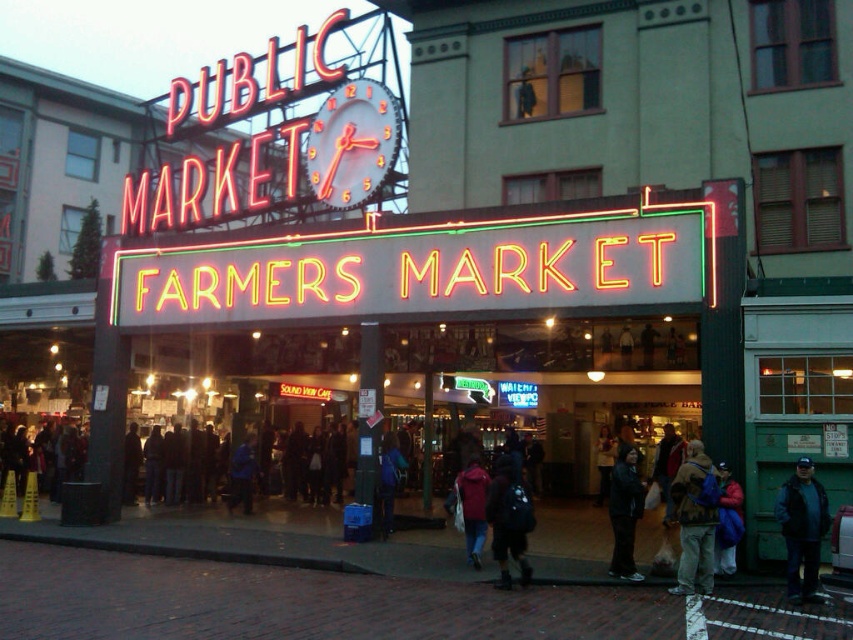
Is dark gray fabric jacket at lower center smaller than blue denim jacket at center?

Incorrect, dark gray fabric jacket at lower center is not smaller in size than blue denim jacket at center.

Is dark gray fabric jacket at lower center thinner than blue denim jacket at center?

In fact, dark gray fabric jacket at lower center might be wider than blue denim jacket at center.

Is point (635, 496) in front of point (381, 496)?

Yes, point (635, 496) is in front of point (381, 496).

This screenshot has height=640, width=853. What are the coordinates of `dark gray fabric jacket at lower center` in the screenshot? It's located at (624, 512).

From the picture: Between metallic clock face at upper center and dark gray fabric jacket at lower center, which one is positioned lower?

dark gray fabric jacket at lower center is lower down.

Based on the photo, can you confirm if metallic clock face at upper center is bigger than dark gray fabric jacket at lower center?

No, metallic clock face at upper center is not bigger than dark gray fabric jacket at lower center.

This screenshot has width=853, height=640. What do you see at coordinates (352, 141) in the screenshot?
I see `metallic clock face at upper center` at bounding box center [352, 141].

Where is `metallic clock face at upper center`? The height and width of the screenshot is (640, 853). metallic clock face at upper center is located at coordinates (352, 141).

Between point (633, 454) and point (483, 513), which one is positioned behind?

The point (633, 454) is more distant.

Does dark gray fabric jacket at lower center appear over dark red jacket at center?

No.

Does point (622, 560) come farther from viewer compared to point (489, 477)?

No, (622, 560) is closer to viewer.

Locate an element on the screen. dark gray fabric jacket at lower center is located at coordinates (624, 512).